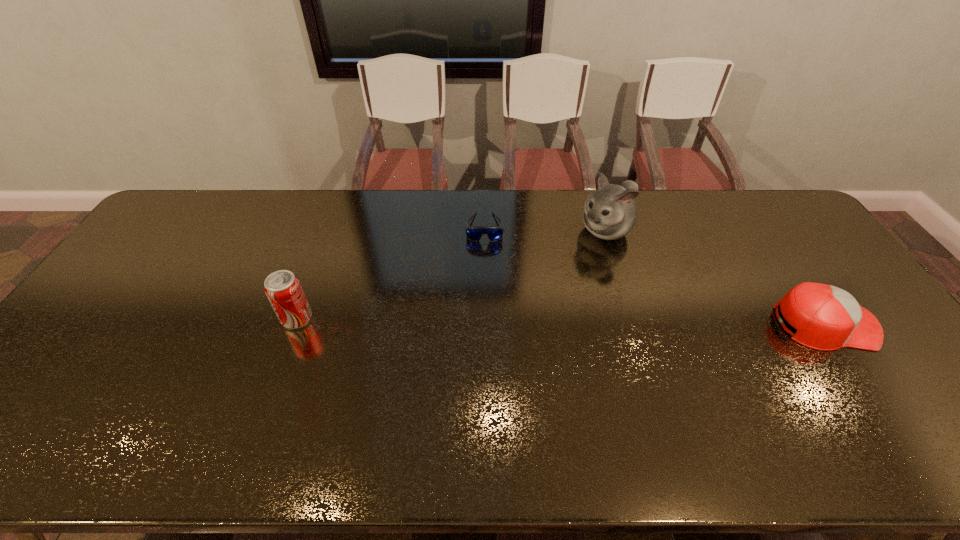
In the image, there is a desktop. Identify the location of vacant region at the left edge. (179, 260).

This screenshot has width=960, height=540. In the image, there is a desktop. In order to click on vacant space at the far left corner in this screenshot , I will do `click(217, 201)`.

Locate an element on the screen. This screenshot has height=540, width=960. free spot between the second object from left to right and the soda can is located at coordinates (391, 273).

The image size is (960, 540). In order to click on vacant space in between the third shortest object and the third tallest object in this screenshot , I will do `click(561, 321)`.

Where is `unoccupied area between the tallest object and the third shortest object`? This screenshot has width=960, height=540. unoccupied area between the tallest object and the third shortest object is located at coordinates (451, 274).

The height and width of the screenshot is (540, 960). I want to click on free spot between the second object from left to right and the third shortest object, so click(391, 273).

At what (x,y) coordinates should I click in order to perform the action: click on unoccupied position between the hamster and the second tallest object. Please return your answer as a coordinate pair (x, y). The image size is (960, 540). Looking at the image, I should click on (451, 274).

This screenshot has height=540, width=960. What are the coordinates of `free spot between the third shortest object and the sunglasses` in the screenshot? It's located at (391, 273).

Where is `empty space between the tallest object and the shortest object`? empty space between the tallest object and the shortest object is located at coordinates (545, 229).

Where is `free space between the shortest object and the tallest object`? free space between the shortest object and the tallest object is located at coordinates (545, 229).